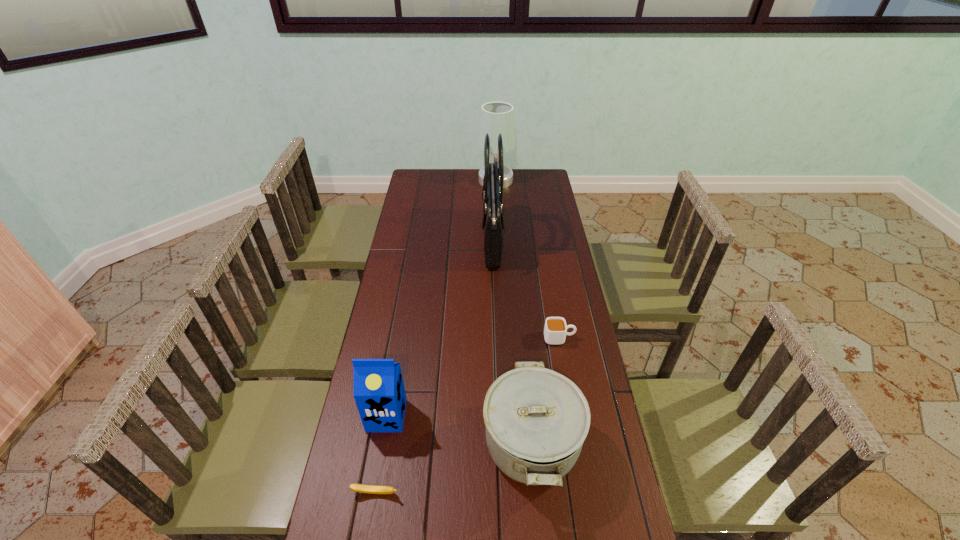
Find the location of `free space between the fourth shortest object and the fifth nearest object`. free space between the fourth shortest object and the fifth nearest object is located at coordinates (440, 328).

Find the location of a particular element. The width and height of the screenshot is (960, 540). unoccupied position between the carton and the farthest object is located at coordinates (442, 298).

Image resolution: width=960 pixels, height=540 pixels. I want to click on unoccupied position between the carton and the shortest object, so click(381, 454).

At what (x,y) coordinates should I click in order to perform the action: click on free space between the saucepan and the banana. Please return your answer as a coordinate pair (x, y). The height and width of the screenshot is (540, 960). Looking at the image, I should click on (453, 469).

You are a GUI agent. You are given a task and a screenshot of the screen. Output one action in this format:
    pyautogui.click(x=<x>, y=<y>)
    Task: Click on the free spot between the second farthest object and the third shortest object
    
    Given the screenshot: What is the action you would take?
    pyautogui.click(x=512, y=342)

Locate an element on the screen. the fifth closest object to the banana is located at coordinates (497, 117).

You are a GUI agent. You are given a task and a screenshot of the screen. Output one action in this format:
    pyautogui.click(x=<x>, y=<y>)
    Task: Click on the fourth closest object to the saucepan
    Image resolution: width=960 pixels, height=540 pixels.
    Given the screenshot: What is the action you would take?
    pyautogui.click(x=493, y=180)

Identify the location of free space that satisfies the following two spatial constraints: 1. on the side with the handle of the fourth nearest object; 2. at the stem of the shortest object. (586, 493).

The width and height of the screenshot is (960, 540). What are the coordinates of `vacant area in the image that satisfies the following two spatial constraints: 1. with an open clasp on the front of the handbag; 2. at the stem of the shortest object` in the screenshot? It's located at (500, 493).

The image size is (960, 540). What are the coordinates of `vacant space that satisfies the following two spatial constraints: 1. on the base of the fifth shortest object; 2. at the stem of the shortest object` in the screenshot? It's located at (512, 493).